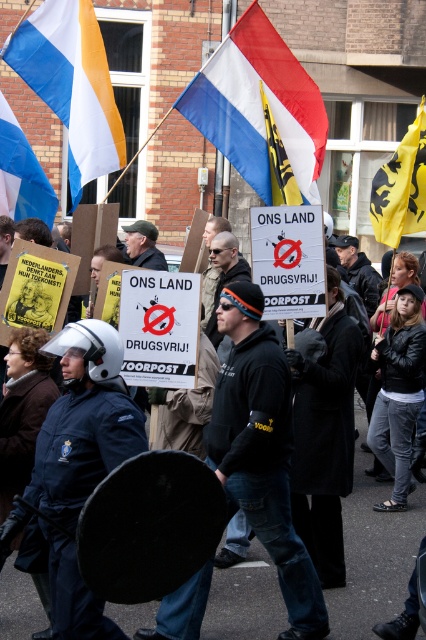
Question: Does black matte jacket at center have a greater width compared to blue and white striped flag at center?

Choices:
 (A) yes
 (B) no

Answer: (A)

Question: Does blue uniform at center have a smaller size compared to blue and white striped flag at center?

Choices:
 (A) no
 (B) yes

Answer: (B)

Question: Estimate the real-world distances between objects in this image. Which object is farther from the blue uniform at center?

Choices:
 (A) tri-color fabric flag at center
 (B) yellow fabric flag at upper right
 (C) blue and white striped flag at center
 (D) black matte jacket at center

Answer: (A)

Question: Which point is farther from the camera taking this photo?

Choices:
 (A) (48, 1)
 (B) (278, 177)

Answer: (A)

Question: Is black matte jacket at center thinner than blue fabric flag at upper left?

Choices:
 (A) yes
 (B) no

Answer: (B)

Question: Which point is closer to the camera?

Choices:
 (A) blue uniform at center
 (B) black matte jacket at center
 (C) yellow fabric flag at upper right

Answer: (B)